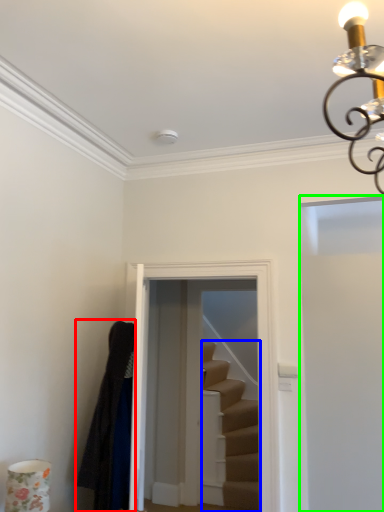
Question: Which is nearer to the robe (highlighted by a red box)? stairs (highlighted by a blue box) or door (highlighted by a green box).

Choices:
 (A) stairs
 (B) door

Answer: (B)